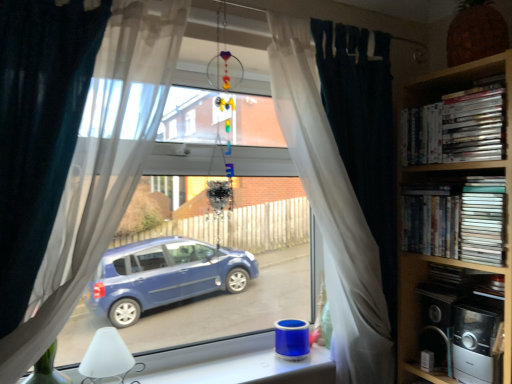
Question: Based on their positions, is white sheer curtain at center, which appears as the second curtain when viewed from the right, located to the left or right of white glossy dvds at upper right, arranged as the first book when viewed from the top?

Choices:
 (A) left
 (B) right

Answer: (A)

Question: Considering their positions, is white sheer curtain at center, which appears as the second curtain when viewed from the right, located in front of or behind white glossy dvds at upper right, placed as the third book when sorted from bottom to top?

Choices:
 (A) behind
 (B) front

Answer: (B)

Question: Which of these objects is positioned farthest from the white sheer curtain at center, arranged as the 2th curtain when viewed from the back?

Choices:
 (A) metallic silver toaster at lower right, which appears as the 2th appliance when viewed from the back
 (B) teal fabric curtain at center, positioned as the second curtain in front-to-back order
 (C) metallic silver microwave at lower right, arranged as the first appliance when viewed from the back
 (D) matte plastic dvds at right, acting as the 2th book starting from the bottom
 (E) black matte book at right, the 1th book positioned from the bottom

Answer: (E)

Question: Which of these objects is positioned farthest from the teal fabric curtain at center, the first curtain positioned from the right?

Choices:
 (A) metallic silver microwave at lower right, positioned as the 2th appliance in front-to-back order
 (B) white glossy dvds at upper right, placed as the third book when sorted from bottom to top
 (C) metallic silver toaster at lower right, which is counted as the 1th appliance, starting from the front
 (D) black matte book at right, the 1th book positioned from the bottom
 (E) white sheer curtain at center, which appears as the second curtain when viewed from the right

Answer: (E)